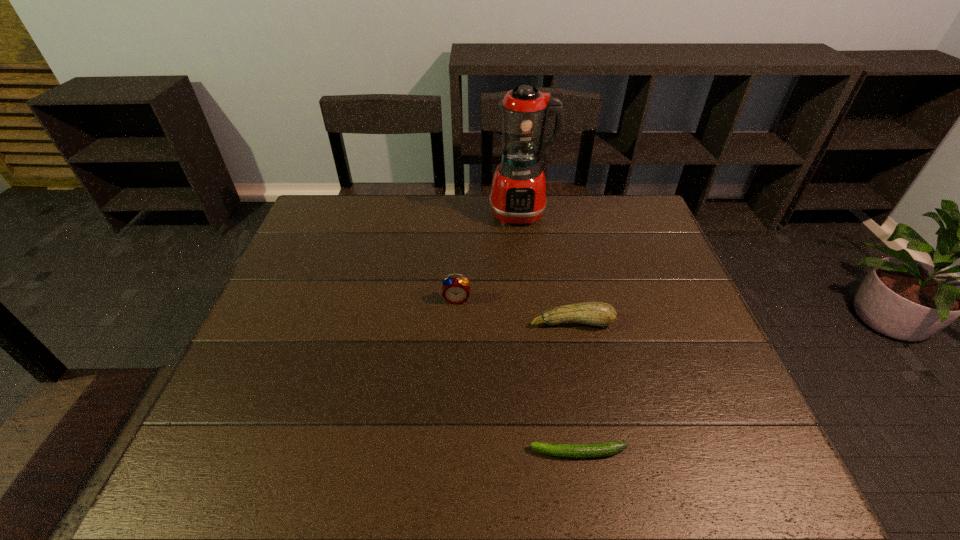
The width and height of the screenshot is (960, 540). I want to click on food processor, so click(x=518, y=196).

The width and height of the screenshot is (960, 540). What are the coordinates of `the tallest object` in the screenshot? It's located at (518, 196).

Find the location of `the second tallest object`. the second tallest object is located at coordinates (455, 290).

I want to click on the third nearest object, so 455,290.

You are a GUI agent. You are given a task and a screenshot of the screen. Output one action in this format:
    pyautogui.click(x=<x>, y=<y>)
    Task: Click on the farther zucchini
    The height and width of the screenshot is (540, 960).
    Given the screenshot: What is the action you would take?
    pyautogui.click(x=601, y=314)

Identify the location of the taller zucchini. (601, 314).

Image resolution: width=960 pixels, height=540 pixels. What are the coordinates of `the shortest object` in the screenshot? It's located at (x=608, y=448).

The image size is (960, 540). In order to click on the nearer zucchini in this screenshot , I will do `click(608, 448)`.

Image resolution: width=960 pixels, height=540 pixels. Find the location of `vacant space located 0.300m on the controls of the tallest object`. vacant space located 0.300m on the controls of the tallest object is located at coordinates (531, 298).

I want to click on free space located 0.150m on the front-facing side of the third nearest object, so (x=454, y=350).